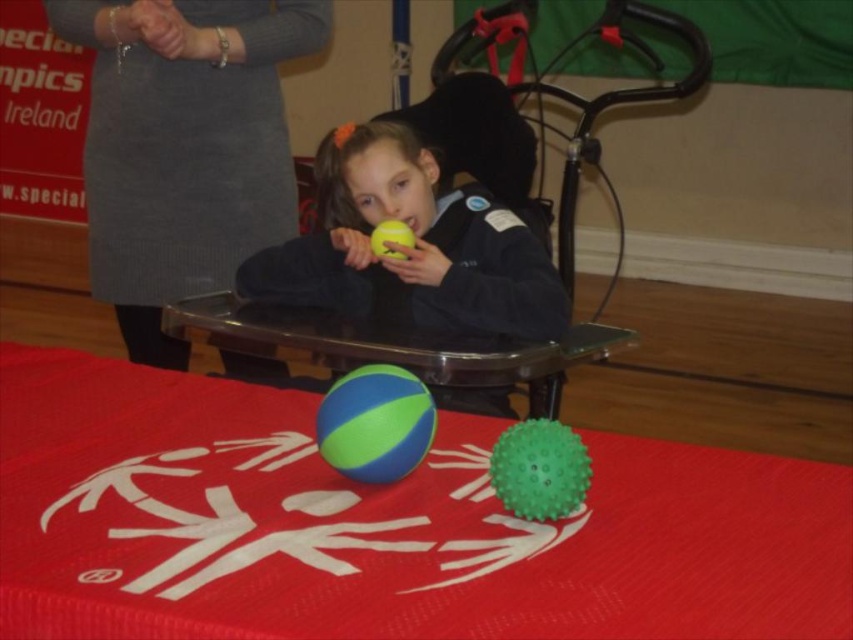
Question: Which object is farther from the camera taking this photo?

Choices:
 (A) yellow rubber ball at center
 (B) blue-green rubber ball at center
 (C) rubberized red mat at lower center
 (D) green rubber beach ball at center

Answer: (D)

Question: Estimate the real-world distances between objects in this image. Which object is farther from the transparent plastic table at center?

Choices:
 (A) blue-green rubber ball at center
 (B) yellow rubber ball at center

Answer: (A)

Question: Is transparent plastic table at center to the left of green rubber beach ball at center from the viewer's perspective?

Choices:
 (A) no
 (B) yes

Answer: (B)

Question: Can you confirm if gray woolen dress at upper left is smaller than yellow rubber ball at center?

Choices:
 (A) yes
 (B) no

Answer: (B)

Question: Which point is farther from the camera taking this photo?

Choices:
 (A) 329,408
 (B) 170,324

Answer: (B)

Question: Is black plastic baby carriage at center above yellow rubber ball at center?

Choices:
 (A) no
 (B) yes

Answer: (B)